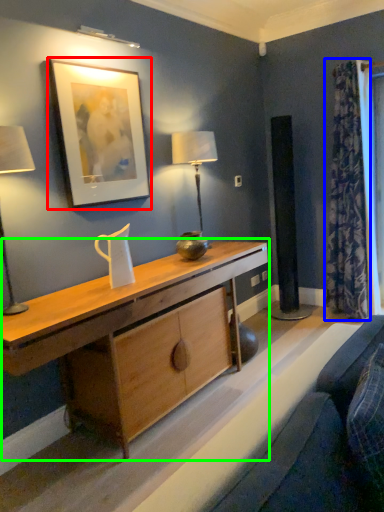
Question: Considering the real-world distances, which object is farthest from picture frame (highlighted by a red box)? curtain (highlighted by a blue box) or desk (highlighted by a green box)?

Choices:
 (A) curtain
 (B) desk

Answer: (A)